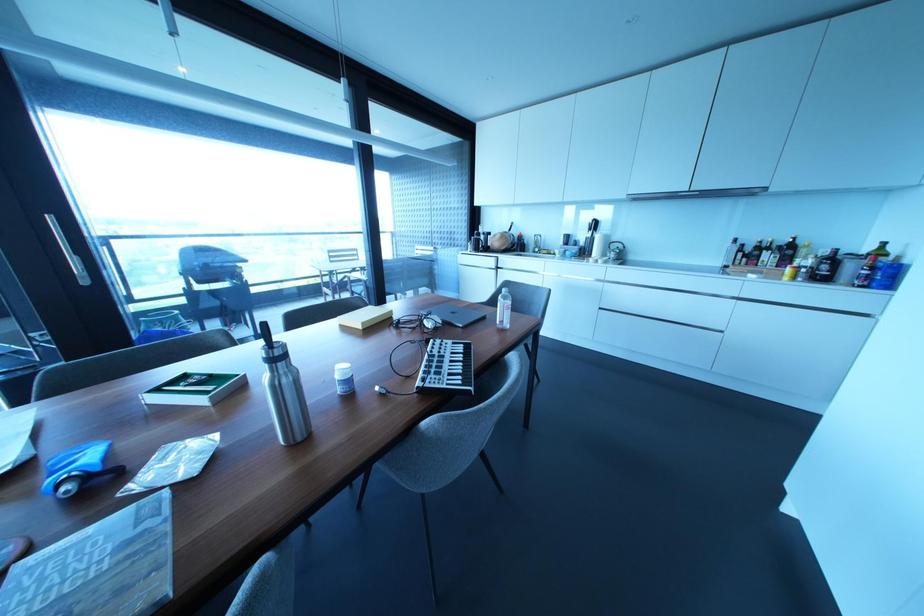
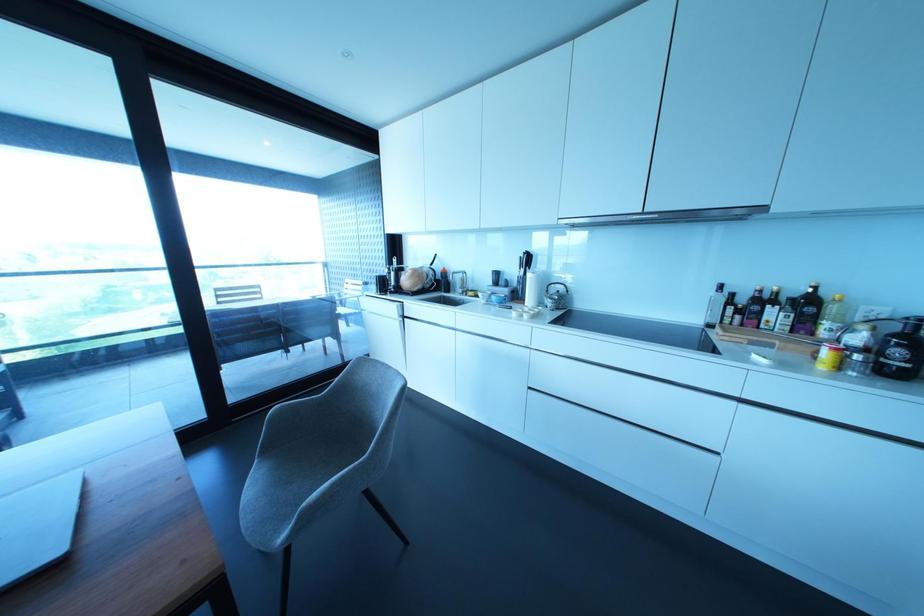
Locate, in the second image, the point that corresponds to [612,254] in the first image.

(549, 302)